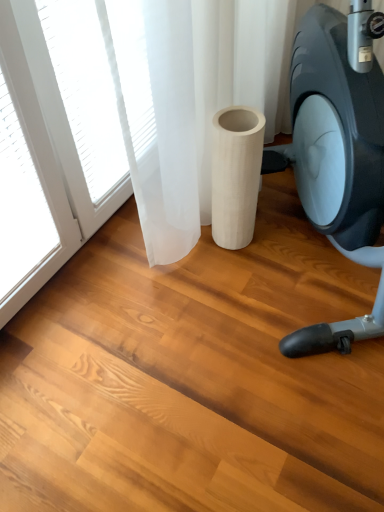
You are a GUI agent. You are given a task and a screenshot of the screen. Output one action in this format:
    pyautogui.click(x=<x>, y=<y>)
    Task: Click on the vacant space to the left of matte black stationary bicycle at right
    Image resolution: width=384 pixels, height=512 pixels.
    Given the screenshot: What is the action you would take?
    pyautogui.click(x=131, y=325)